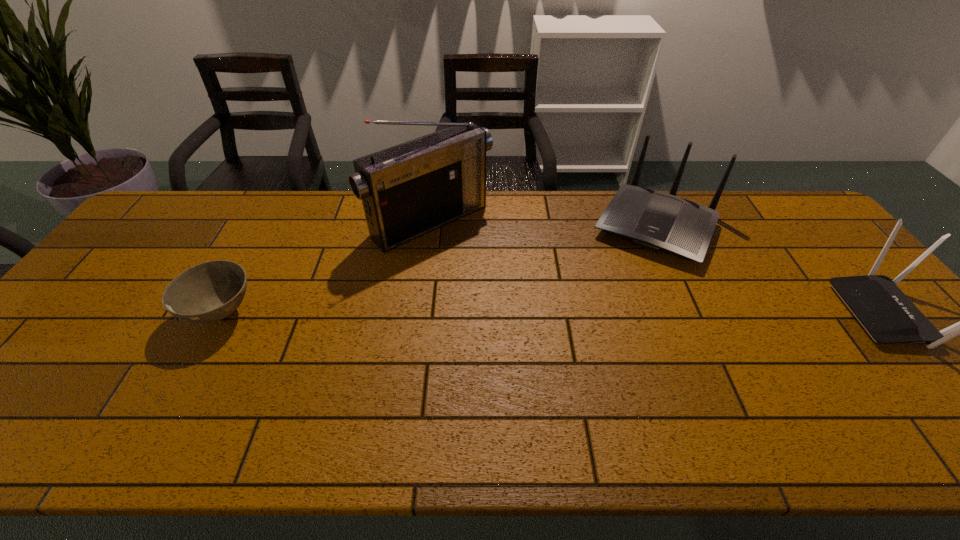
Locate an element on the screen. bowl is located at coordinates [x=207, y=292].

This screenshot has width=960, height=540. Find the location of `the shortest object`. the shortest object is located at coordinates (207, 292).

You are a GUI agent. You are given a task and a screenshot of the screen. Output one action in this format:
    pyautogui.click(x=<x>, y=<y>)
    Task: Click on the second object from left to right
    The image size is (960, 540).
    Given the screenshot: What is the action you would take?
    pyautogui.click(x=408, y=190)

This screenshot has width=960, height=540. Find the location of `the tallest object`. the tallest object is located at coordinates (408, 190).

This screenshot has width=960, height=540. Find the location of `the left router`. the left router is located at coordinates (654, 220).

Identify the location of the taller router. This screenshot has height=540, width=960. (654, 220).

What are the coordinates of `blank area located on the front of the bowl` in the screenshot? It's located at (180, 389).

Where is `vacant space located on the front-facing side of the second object from left to right`? vacant space located on the front-facing side of the second object from left to right is located at coordinates (486, 266).

Identify the location of vacant space situated on the front-facing side of the second object from left to right. (494, 273).

Identify the location of vacant space located on the front-facing side of the second object from left to right. This screenshot has width=960, height=540. (492, 272).